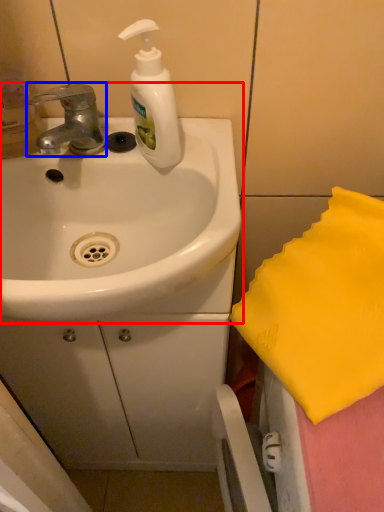
Question: Which object appears closest to the camera in this image, sink (highlighted by a red box) or tap (highlighted by a blue box)?

Choices:
 (A) sink
 (B) tap

Answer: (A)